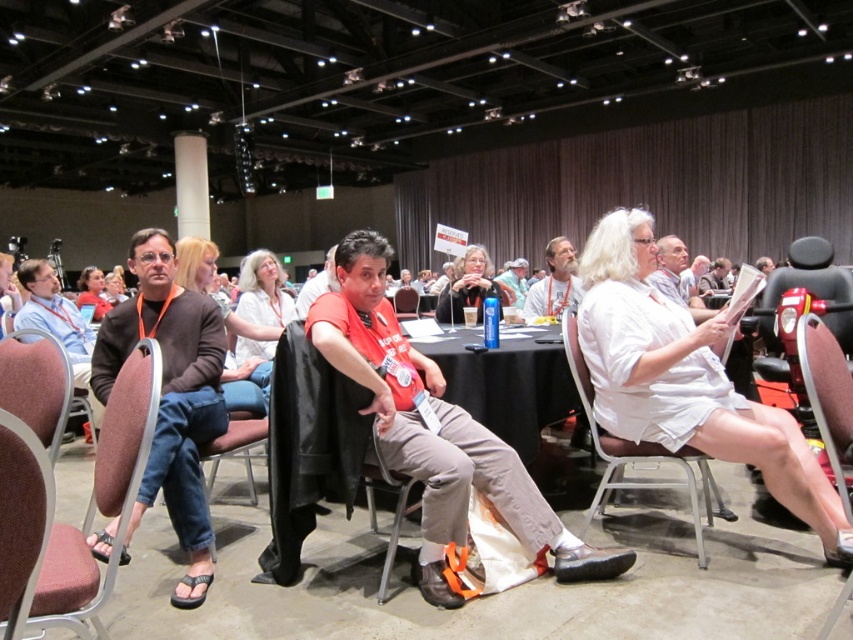
I want to click on metallic silver chair at center, so click(x=636, y=452).

Looking at this image, is metallic silver chair at center wider than brown leather chair at lower right?

Indeed, metallic silver chair at center has a greater width compared to brown leather chair at lower right.

Is point (587, 518) positioned after point (849, 499)?

Yes, point (587, 518) is behind point (849, 499).

Identify the location of metallic silver chair at center. (636, 452).

Which is above, matte white shirt at center or white plastic cup at center?

Positioned higher is white plastic cup at center.

Does point (480, 285) come behind point (514, 259)?

That is False.

Based on the photo, measure the distance between point (463, 304) and camera.

Point (463, 304) and camera are 4.05 meters apart.

At what (x,y) coordinates should I click in order to perform the action: click on matte white shirt at center. Please return your answer as a coordinate pair (x, y). This screenshot has height=640, width=853. Looking at the image, I should click on (468, 285).

Can you confirm if brown fabric chair at left is positioned below brown leather chair at lower right?

Incorrect, brown fabric chair at left is not positioned below brown leather chair at lower right.

The width and height of the screenshot is (853, 640). What do you see at coordinates (125, 435) in the screenshot?
I see `brown fabric chair at left` at bounding box center [125, 435].

At what (x,y) coordinates should I click in order to perform the action: click on brown fabric chair at left. Please return your answer as a coordinate pair (x, y). This screenshot has width=853, height=640. Looking at the image, I should click on (125, 435).